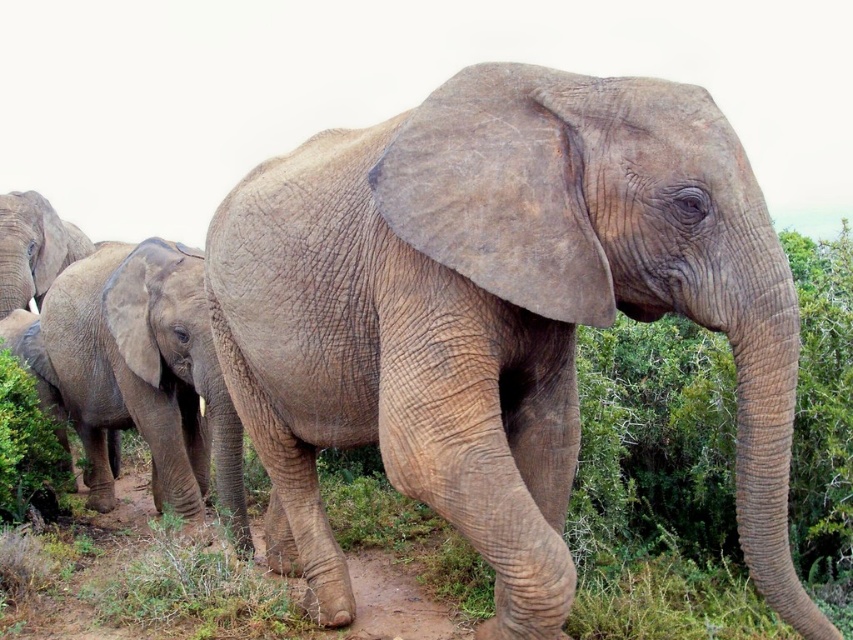
You are a wildlife photographer standing at the camera position. You want to take a closeup photo of the gray textured baby elephant at lower left. The camera has a maximum zoom range of 4 meters. Can you get a clear closeup without moving closer?

The gray textured baby elephant at lower left is 4.47 meters from the camera. Since the camera can only zoom up to 4 meters, you cannot get a clear closeup without moving closer.

You are a wildlife photographer observing the elephants in the savanna. You need to determine which elephant is taller between the gray textured elephant at center and the gray textured baby elephant at lower left. Which one is taller?

The gray textured elephant at center is taller than the gray textured baby elephant at lower left.

You are a wildlife photographer standing at the center of the savanna. You want to take a photo of the gray textured baby elephant at lower left. Which direction should you move to get closer to it?

The gray textured baby elephant at lower left is located at point (144, 371), so you should move towards the lower left direction to get closer to it.